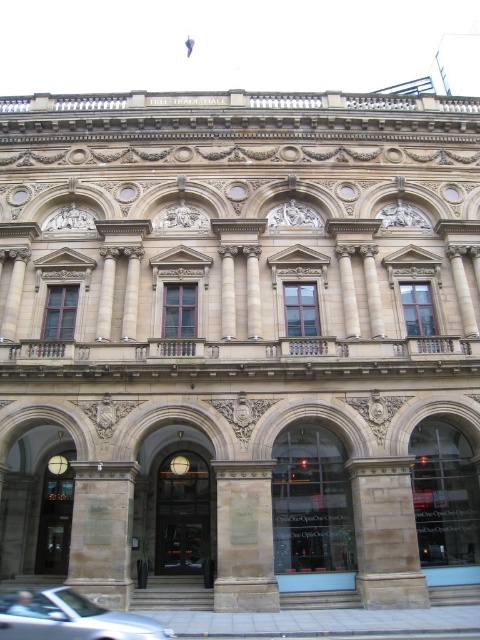
You are standing in front of the grand classical building and want to determine which of the two points, point (374, 588) or point (111, 500), is nearer to you. Based on the building details, which point is closer?

Point (374, 588) is closer to the viewer than point (111, 500).

You are standing in front of the grand classical building and notice a silver metallic car at lower left and a stone textured column at center. From your perspective, which object is positioned to the right of the other?

The stone textured column at center is to the right of the silver metallic car at lower left.

You are an architect designing a new pathway in front of the grand classical building. You need to place a bench between the brown stone pillar at center and the brown stone pillar at lower left. The bench is 2 meters long. Is there enough space between the two pillars to place the bench without moving the pillars?

The distance between the brown stone pillar at center and the brown stone pillar at lower left is 16.81 meters. Since the bench is only 2 meters long, there is more than enough space to place it between the two pillars without moving them.